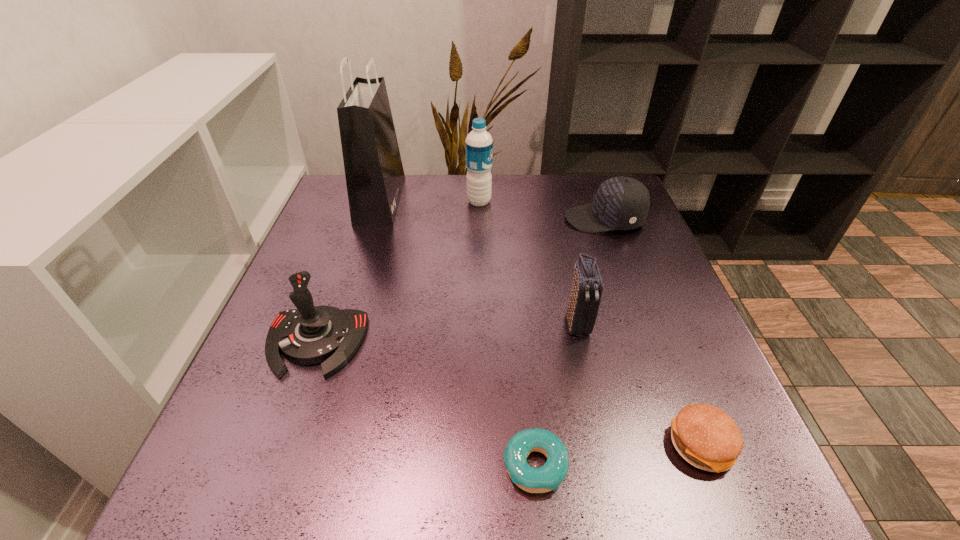
Where is `free space that satisfies the following two spatial constraints: 1. on the handle side of the sixth tallest object; 2. on the left side of the joystick`? This screenshot has height=540, width=960. free space that satisfies the following two spatial constraints: 1. on the handle side of the sixth tallest object; 2. on the left side of the joystick is located at coordinates (278, 446).

Locate an element on the screen. The image size is (960, 540). blank area in the image that satisfies the following two spatial constraints: 1. on the handle side of the joystick; 2. on the right side of the fourth object from left to right is located at coordinates (272, 465).

Identify the location of vacant space that satisfies the following two spatial constraints: 1. on the handle side of the hamburger; 2. on the left side of the joystick. (278, 446).

You are a GUI agent. You are given a task and a screenshot of the screen. Output one action in this format:
    pyautogui.click(x=<x>, y=<y>)
    Task: Click on the vacant region that satisfies the following two spatial constraints: 1. with the zip open on the third object from right to left; 2. on the right side of the second shortest object
    Image resolution: width=960 pixels, height=540 pixels.
    Given the screenshot: What is the action you would take?
    pyautogui.click(x=604, y=446)

Where is `free location that satisfies the following two spatial constraints: 1. on the back side of the fourth object from right to left; 2. on the front with handles of the tallest object`? Image resolution: width=960 pixels, height=540 pixels. free location that satisfies the following two spatial constraints: 1. on the back side of the fourth object from right to left; 2. on the front with handles of the tallest object is located at coordinates (510, 200).

This screenshot has width=960, height=540. Find the location of `blank area in the image that satisfies the following two spatial constraints: 1. with the zip open on the clutch bag; 2. on the right side of the hamburger`. blank area in the image that satisfies the following two spatial constraints: 1. with the zip open on the clutch bag; 2. on the right side of the hamburger is located at coordinates (604, 446).

Find the location of `vacant region that satisfies the following two spatial constraints: 1. on the label of the third object from left to right; 2. on the left side of the doughnut`. vacant region that satisfies the following two spatial constraints: 1. on the label of the third object from left to right; 2. on the left side of the doughnut is located at coordinates (478, 465).